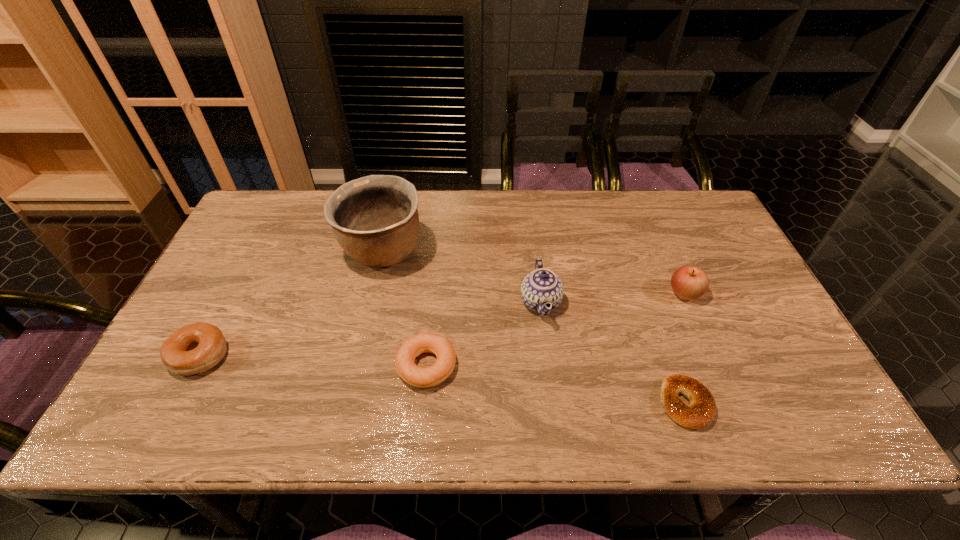
Identify the location of free area in between the leftmost object and the apple. This screenshot has height=540, width=960. (443, 325).

The width and height of the screenshot is (960, 540). I want to click on free spot between the second shortest object and the leftmost bagel, so click(313, 361).

Image resolution: width=960 pixels, height=540 pixels. I want to click on vacant space that's between the tallest object and the fourth object from left to right, so click(x=462, y=277).

The height and width of the screenshot is (540, 960). Identify the location of empty location between the fifth tallest object and the third shortest object. (313, 361).

Where is `empty location between the second bagel from right to left and the rightmost bagel`? Image resolution: width=960 pixels, height=540 pixels. empty location between the second bagel from right to left and the rightmost bagel is located at coordinates (556, 384).

This screenshot has height=540, width=960. Identify the location of free area in between the third shortest object and the apple. (443, 325).

Locate which object is the second closest to the fourth object from left to right. Please provide its 2D coordinates. Your answer should be formatted as a tuple, i.e. [(x, y)], where the tuple contains the x and y coordinates of a point satisfying the conditions above.

[(699, 413)]

Select which object is the closest to the second tallest bagel. Please provide its 2D coordinates. Your answer should be formatted as a tuple, i.e. [(x, y)], where the tuple contains the x and y coordinates of a point satisfying the conditions above.

[(542, 286)]

Locate which bagel is the second closest to the third object from right to left. Please provide its 2D coordinates. Your answer should be formatted as a tuple, i.e. [(x, y)], where the tuple contains the x and y coordinates of a point satisfying the conditions above.

[(699, 413)]

The height and width of the screenshot is (540, 960). Find the location of `bagel identified as the closest to the leftmost object`. bagel identified as the closest to the leftmost object is located at coordinates click(x=412, y=347).